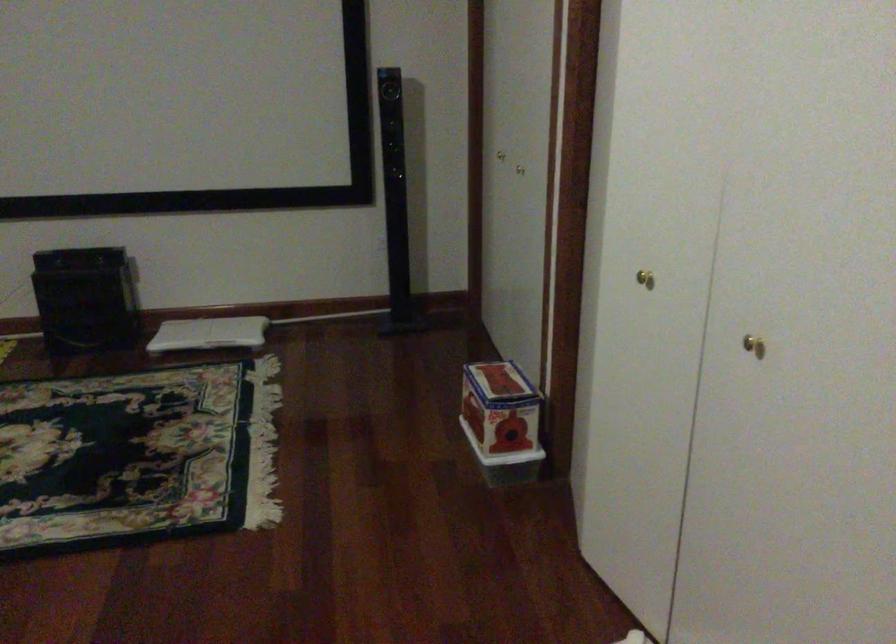
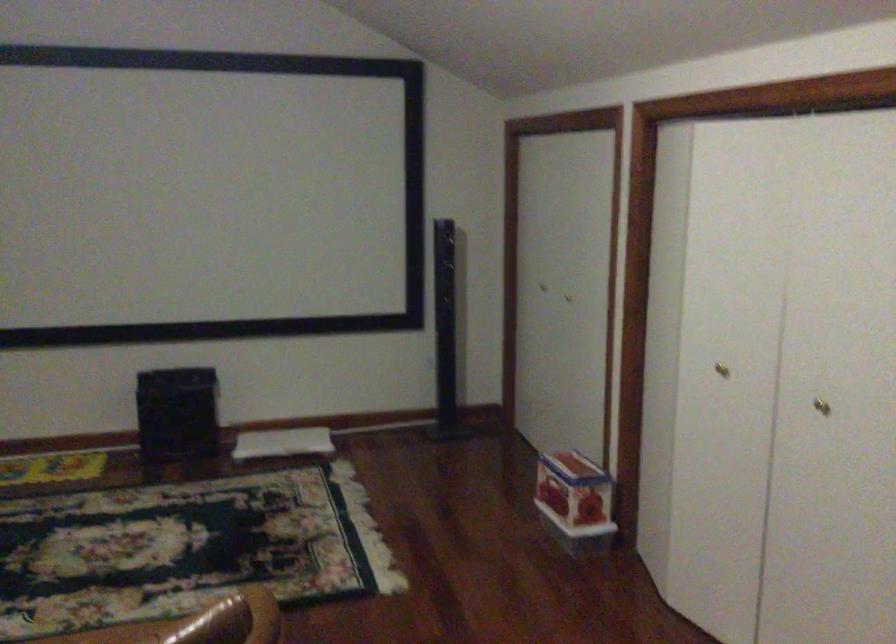
Where in the second image is the point corresponding to point (755, 346) from the first image?

(821, 406)